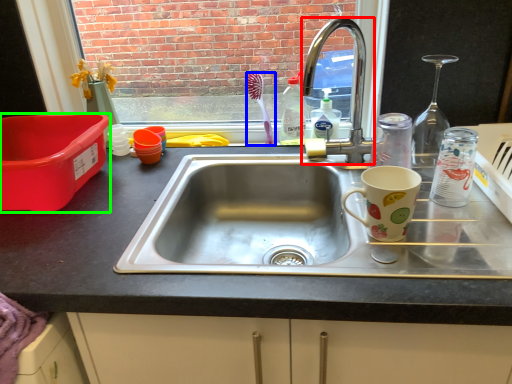
Question: Based on their relative distances, which object is nearer to faucet (highlighted by a red box)? Choose from toothbrush (highlighted by a blue box) and box (highlighted by a green box).

Choices:
 (A) toothbrush
 (B) box

Answer: (A)